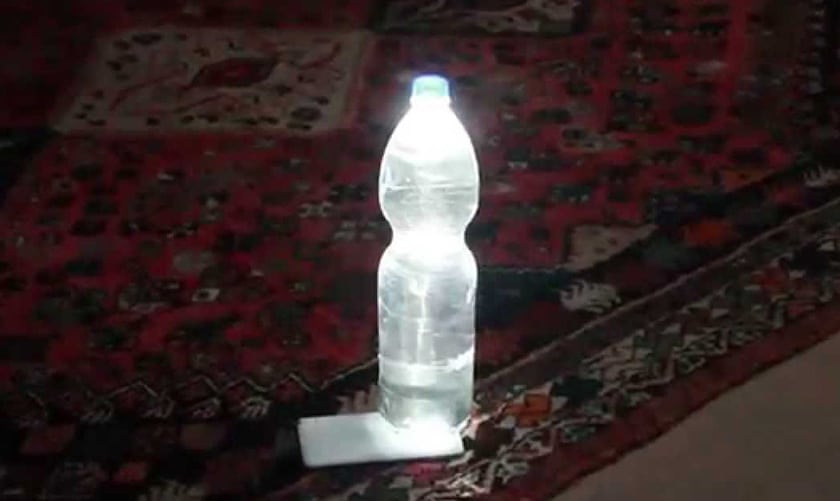
I want to click on bottle, so click(428, 184).